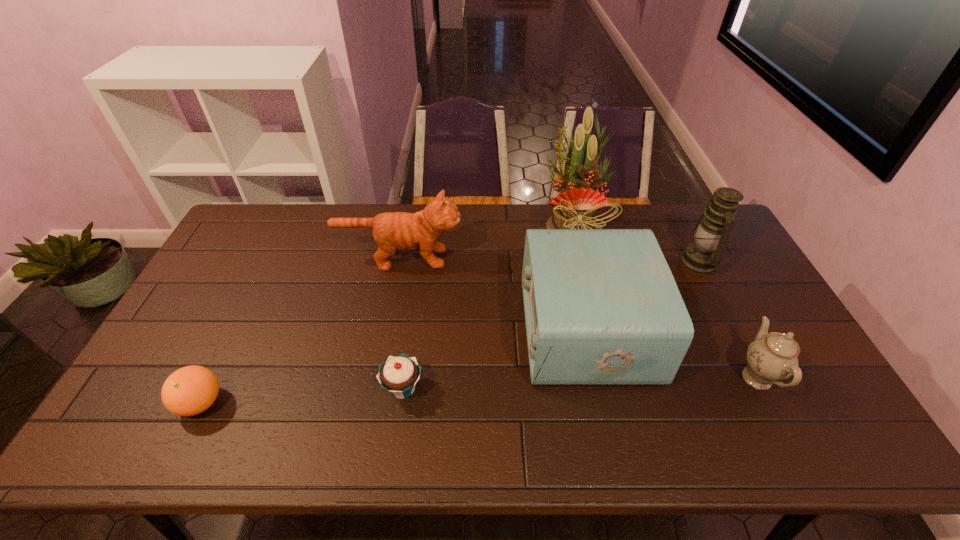
Locate an element on the screen. flower arrangement is located at coordinates (577, 204).

Find the location of `oil lamp`. oil lamp is located at coordinates (710, 235).

Image resolution: width=960 pixels, height=540 pixels. I want to click on cat, so click(393, 231).

Find the location of `radio receiver`. radio receiver is located at coordinates (602, 307).

In order to click on the third shortest object in this screenshot , I will do `click(773, 357)`.

Where is `the leftmost object`? Image resolution: width=960 pixels, height=540 pixels. the leftmost object is located at coordinates (188, 391).

Identify the location of cupcake. The height and width of the screenshot is (540, 960). (399, 375).

Locate an element on the screen. free space located 0.360m in front of the tallest object with the fan visible is located at coordinates (598, 333).

Identify the location of vacant point located 0.060m on the front of the oil lamp. (718, 296).

Where is `vacant space located on the face of the cat`? vacant space located on the face of the cat is located at coordinates (513, 258).